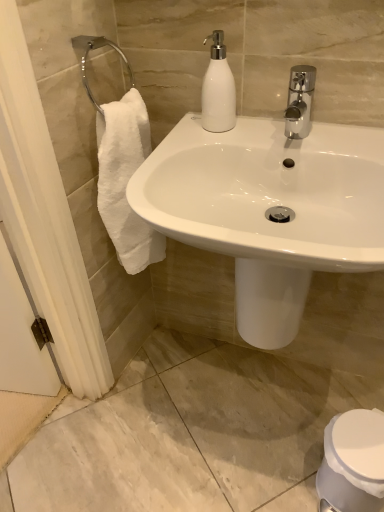
You are a GUI agent. You are given a task and a screenshot of the screen. Output one action in this format:
    pyautogui.click(x=<x>, y=<y>)
    Task: Click on the vacant space to the left of white glossy soap dispenser at upper center
    
    Given the screenshot: What is the action you would take?
    pyautogui.click(x=181, y=132)